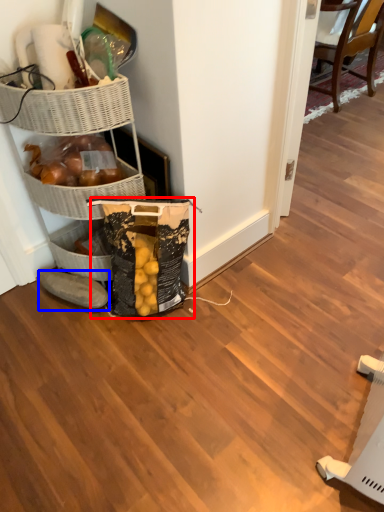
Question: Which point is further to the camera, grocery bag (highlighted by a red box) or footwear (highlighted by a blue box)?

Choices:
 (A) grocery bag
 (B) footwear

Answer: (B)